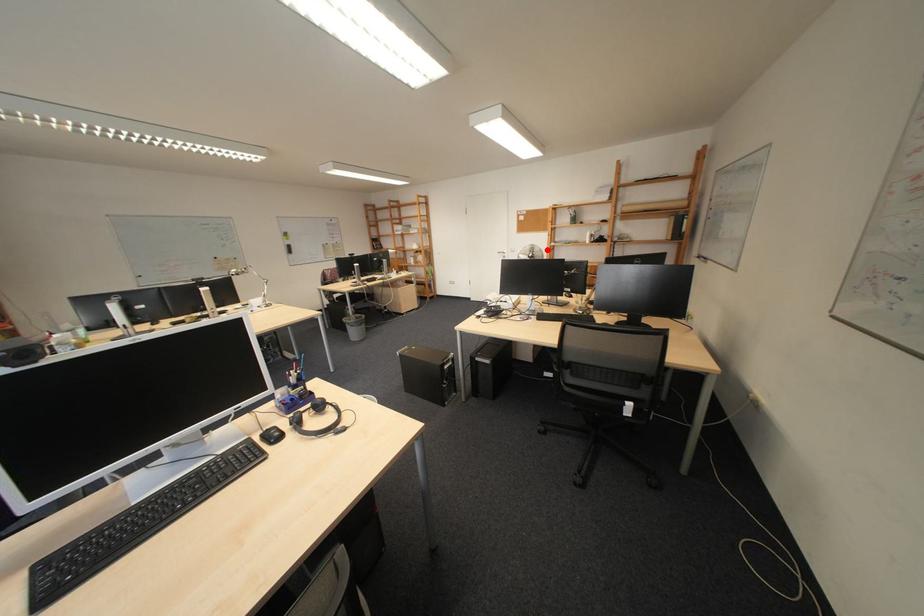
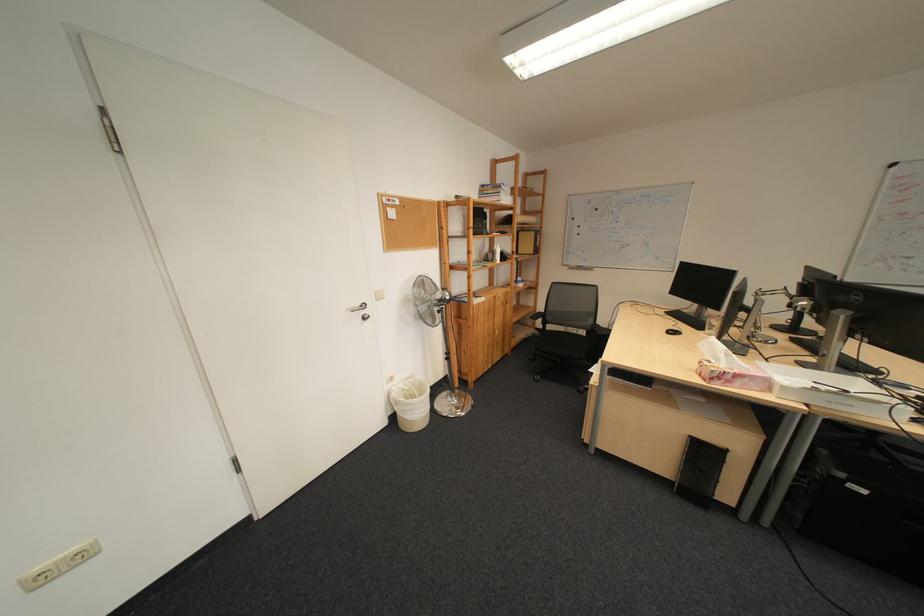
Question: I am providing you with two images of the same scene from different viewpoints. In image1, a red point is highlighted. Considering the same 3D point in image2, which of the following is correct?

Choices:
 (A) It is closer
 (B) It is farther

Answer: (B)